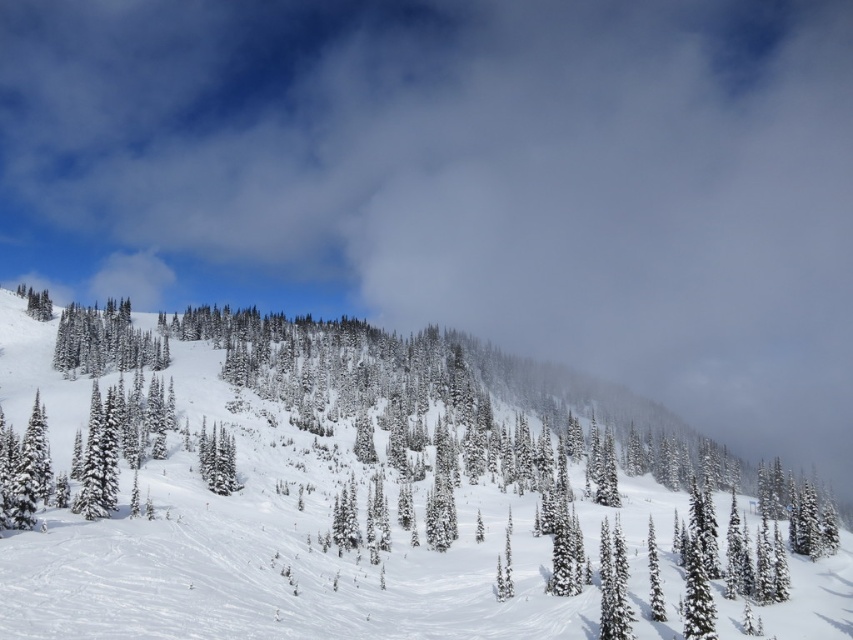
Who is shorter, white snow-covered tree at lower left or white snow-covered tree at lower right?

Standing shorter between the two is white snow-covered tree at lower right.

Does white snow-covered tree at lower left have a lesser height compared to white snow-covered tree at lower right?

In fact, white snow-covered tree at lower left may be taller than white snow-covered tree at lower right.

Is point (33, 499) closer to viewer compared to point (624, 572)?

No, (33, 499) is further to viewer.

Identify the location of white snow-covered tree at lower left. (28, 472).

Between point (682, 579) and point (67, 330), which one is positioned behind?

The point (67, 330) is more distant.

Is white fluffy snow at center below green matte trees at left?

Yes, white fluffy snow at center is below green matte trees at left.

Describe the element at coordinates (315, 497) in the screenshot. I see `white fluffy snow at center` at that location.

Where is `white fluffy snow at center`? This screenshot has height=640, width=853. white fluffy snow at center is located at coordinates (315, 497).

Who is taller, white fluffy snow at center or white snow-covered tree at lower left?

Standing taller between the two is white fluffy snow at center.

Can you confirm if white fluffy snow at center is positioned to the right of white snow-covered tree at lower left?

Yes, white fluffy snow at center is to the right of white snow-covered tree at lower left.

Between point (717, 557) and point (26, 502), which one is positioned in front?

Point (26, 502)

Find the location of a particular element. white fluffy snow at center is located at coordinates (315, 497).